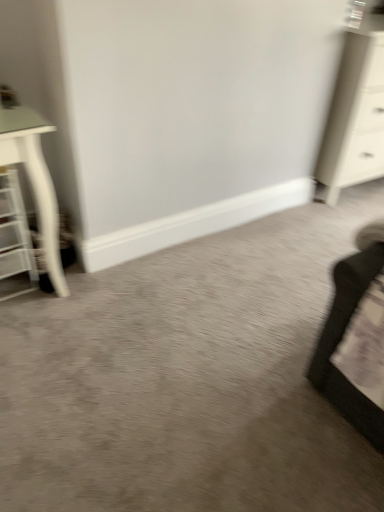
Question: Would you say white glossy chest of drawers at upper right is inside or outside white mesh shelf at left?

Choices:
 (A) outside
 (B) inside

Answer: (A)

Question: From a real-world perspective, is white glossy chest of drawers at upper right physically located above or below white mesh shelf at left?

Choices:
 (A) above
 (B) below

Answer: (A)

Question: Based on their positions, is white glossy chest of drawers at upper right located to the left or right of white mesh shelf at left?

Choices:
 (A) right
 (B) left

Answer: (A)

Question: In terms of size, does white mesh shelf at left appear bigger or smaller than white glossy chest of drawers at upper right?

Choices:
 (A) small
 (B) big

Answer: (A)

Question: Is point (6, 257) positioned closer to the camera than point (374, 154)?

Choices:
 (A) closer
 (B) farther

Answer: (A)

Question: From the image's perspective, relative to white glossy chest of drawers at upper right, is white mesh shelf at left above or below?

Choices:
 (A) below
 (B) above

Answer: (A)

Question: From a real-world perspective, is white mesh shelf at left positioned above or below white glossy chest of drawers at upper right?

Choices:
 (A) above
 (B) below

Answer: (B)